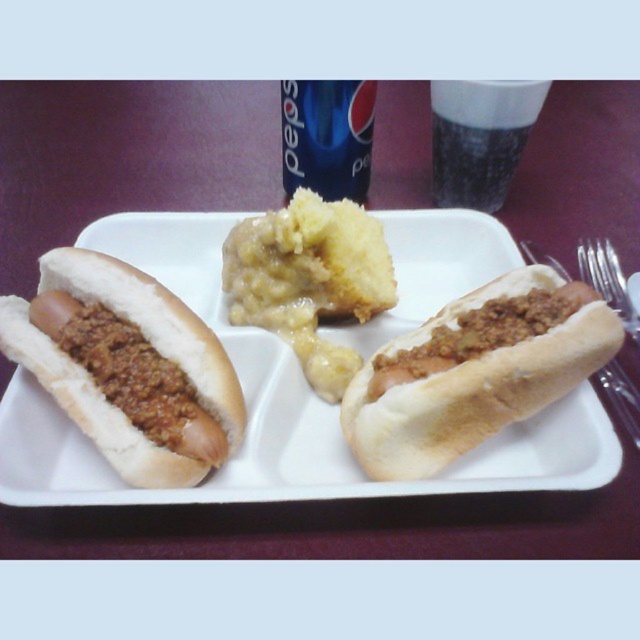
Question: Does white matte tray at center lie in front of brown matte hot dog at center?

Choices:
 (A) yes
 (B) no

Answer: (A)

Question: Considering the real-world distances, which object is closest to the black glass at upper center?

Choices:
 (A) brown matte hot dog at left
 (B) white matte tray at center

Answer: (B)

Question: Which object is the farthest from the brown matte hot dog at left?

Choices:
 (A) white matte tray at center
 (B) black glass at upper center
 (C) yellowish mashed potato at center
 (D) blue plastic cup at upper center

Answer: (B)

Question: Can you confirm if brown matte hot dog at center is positioned to the right of black glass at upper center?

Choices:
 (A) yes
 (B) no

Answer: (B)

Question: Can you confirm if yellowish mashed potato at center is bigger than blue plastic cup at upper center?

Choices:
 (A) yes
 (B) no

Answer: (A)

Question: Among these objects, which one is farthest from the camera?

Choices:
 (A) white matte tray at center
 (B) black glass at upper center
 (C) brown matte hot dog at center
 (D) yellowish mashed potato at center

Answer: (B)